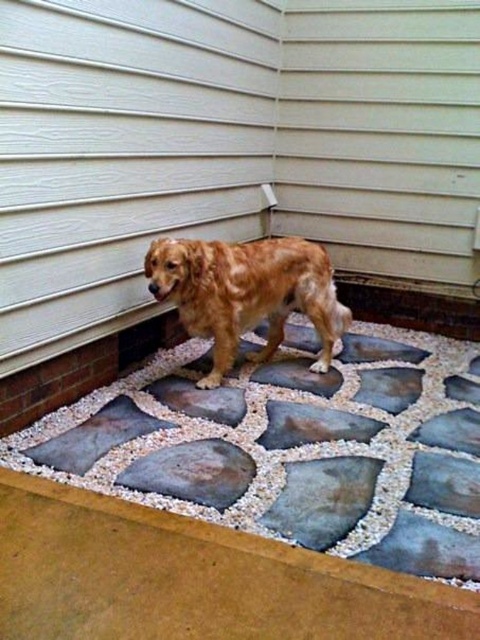
Consider the image. You are a painter hired to paint the white siding at upper left and the golden fur dog at center. You have a limited amount of paint. Which object requires more paint to cover its surface?

The white siding at upper left requires more paint because it is bigger than the golden fur dog at center.

Based on the scene, can you determine if the white siding at upper left is wider than the golden fur dog at center?

The white siding at upper left might be wider than the golden fur dog at center according to the description.